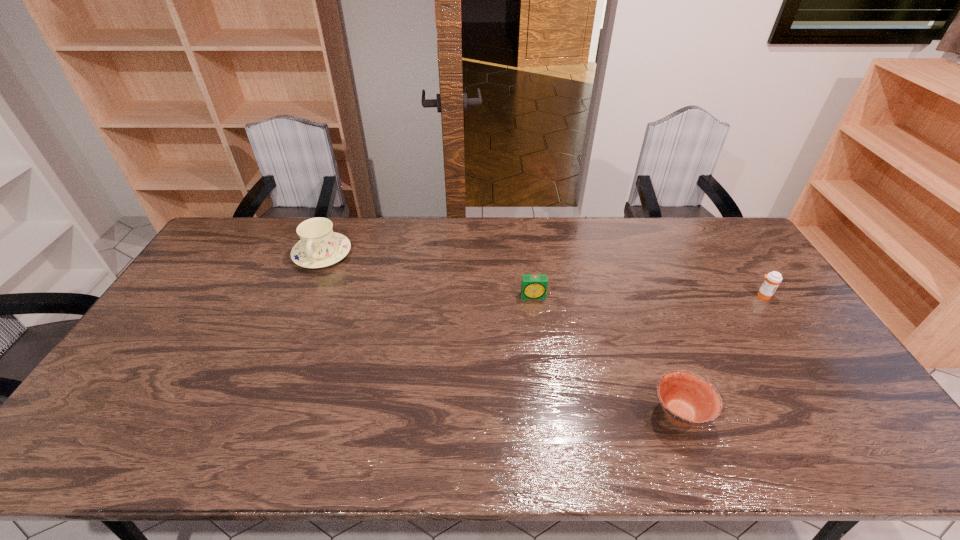
Locate an element on the screen. free location that satisfies the following two spatial constraints: 1. on the handle side of the rightmost object; 2. on the right side of the tallest object is located at coordinates (304, 295).

Locate an element on the screen. vacant region that satisfies the following two spatial constraints: 1. on the handle side of the chinaware; 2. on the right side of the nearest object is located at coordinates (255, 413).

You are a GUI agent. You are given a task and a screenshot of the screen. Output one action in this format:
    pyautogui.click(x=<x>, y=<y>)
    Task: Click on the vacant space that satisfies the following two spatial constraints: 1. on the handle side of the medicine; 2. on the left side of the chinaware
    The height and width of the screenshot is (540, 960).
    Given the screenshot: What is the action you would take?
    pyautogui.click(x=304, y=295)